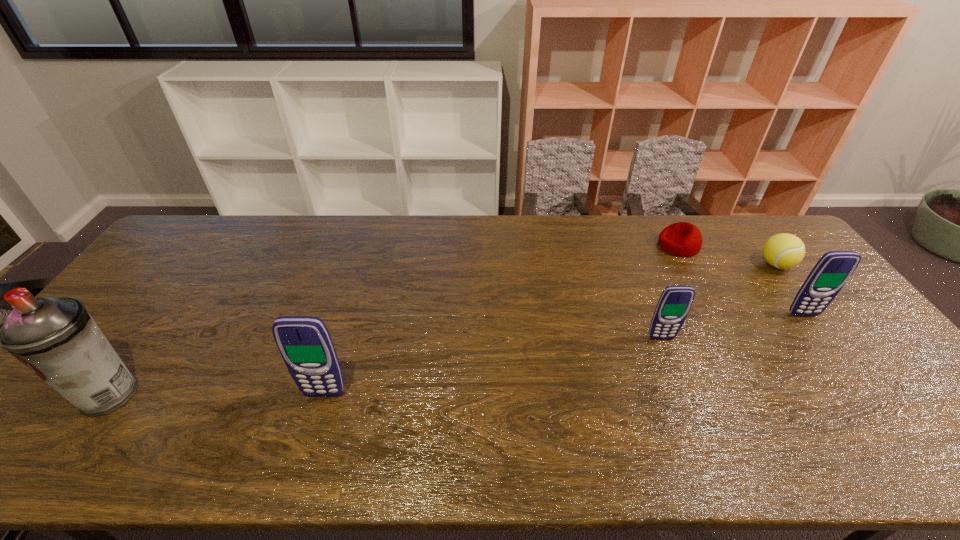
In order to click on the second object from left to right in this screenshot , I will do `click(304, 342)`.

Where is `the nearest cellular telephone`? Image resolution: width=960 pixels, height=540 pixels. the nearest cellular telephone is located at coordinates (304, 342).

Where is `the shortest cellular telephone`? the shortest cellular telephone is located at coordinates (675, 302).

Locate an element on the screen. the second cellular telephone from right to left is located at coordinates (675, 302).

Image resolution: width=960 pixels, height=540 pixels. I want to click on the rightmost cellular telephone, so click(832, 271).

The image size is (960, 540). Identify the location of the second shortest cellular telephone. (832, 271).

This screenshot has height=540, width=960. What are the coordinates of `the shortest object` in the screenshot? It's located at (682, 239).

Find the location of `the third object from right to left`. the third object from right to left is located at coordinates (682, 239).

Where is `tennis ball`? This screenshot has height=540, width=960. tennis ball is located at coordinates (783, 251).

Find the location of a particular element. the leftmost object is located at coordinates (55, 337).